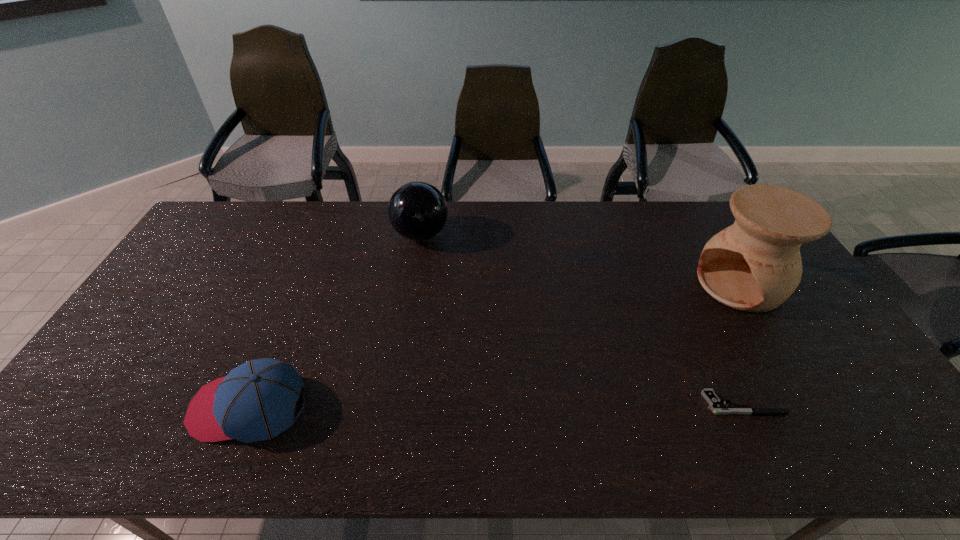
Locate an element on the screen. empty location between the pistol and the third tallest object is located at coordinates [x=496, y=405].

This screenshot has width=960, height=540. I want to click on free point between the pottery and the second shortest object, so click(494, 346).

Where is `blank region between the second shortest object and the farthest object`? The width and height of the screenshot is (960, 540). blank region between the second shortest object and the farthest object is located at coordinates (335, 321).

Locate an element on the screen. Image resolution: width=960 pixels, height=540 pixels. empty location between the second object from left to right and the third tallest object is located at coordinates (335, 321).

Where is `the closest object relative to the second shortest object`? the closest object relative to the second shortest object is located at coordinates (417, 210).

Point out which object is positioned as the nearest to the third shortest object. Please provide its 2D coordinates. Your answer should be formatted as a tuple, i.e. [(x, y)], where the tuple contains the x and y coordinates of a point satisfying the conditions above.

[(256, 401)]